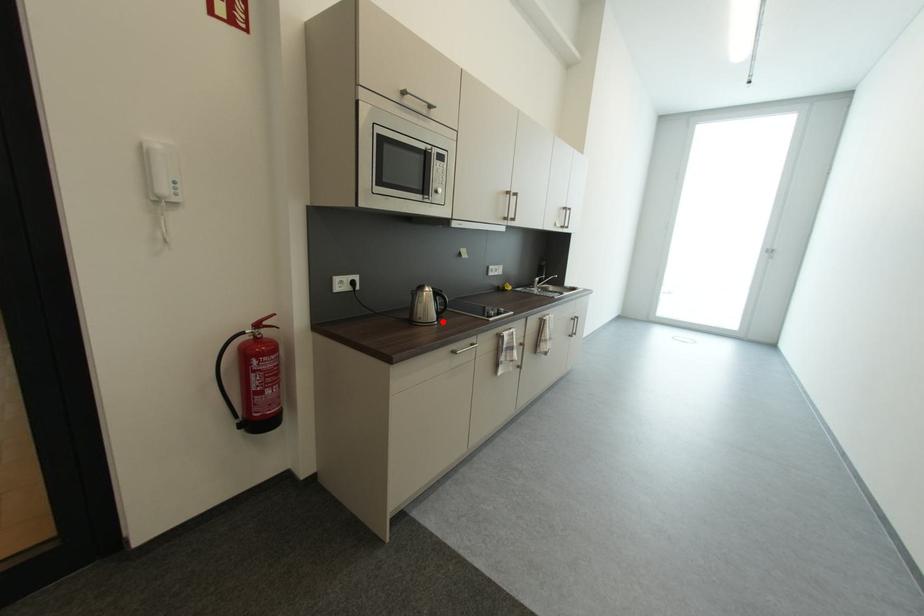
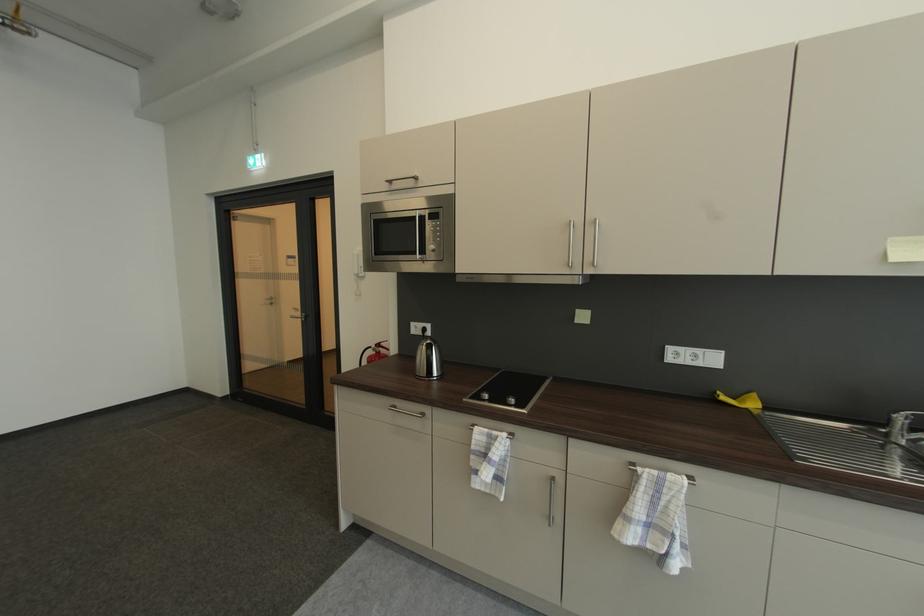
Find the pixel in the second image that matches the highlighted location in the first image.

(432, 378)